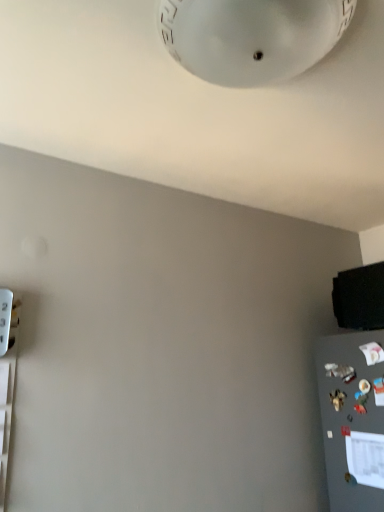
In order to face white glossy lampshade at upper center, should I rotate leftwards or rightwards?

A 6.645 degree turn to the right will do.

What is the approximate width of white glossy lampshade at upper center?

19.95 inches.

This screenshot has width=384, height=512. Describe the element at coordinates (252, 37) in the screenshot. I see `white glossy lampshade at upper center` at that location.

Locate an element on the screen. This screenshot has height=512, width=384. white glossy lampshade at upper center is located at coordinates (252, 37).

Find the location of a particular element. white glossy lampshade at upper center is located at coordinates (252, 37).